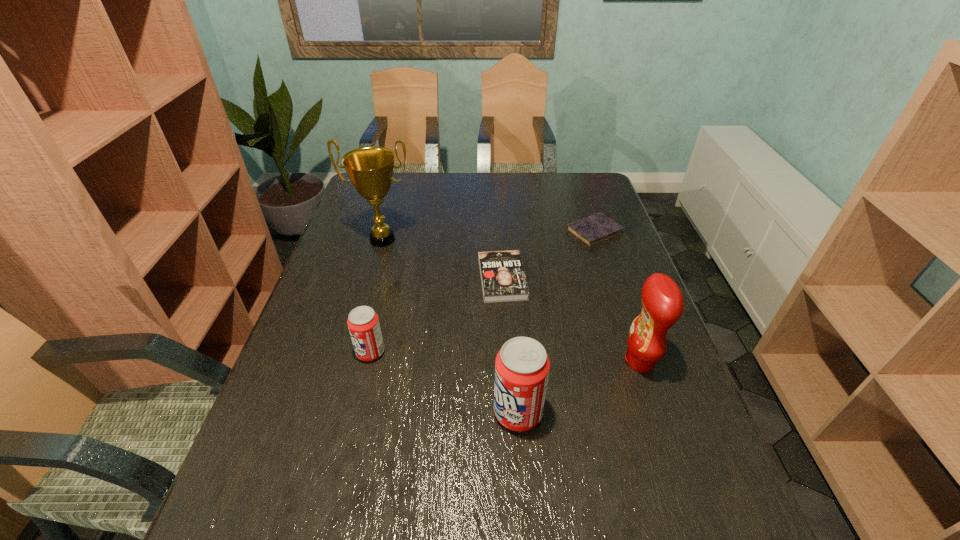
Where is `free spot located 0.140m on the label side of the second tallest object`? free spot located 0.140m on the label side of the second tallest object is located at coordinates (564, 361).

Where is `object positioned at the left edge`? Image resolution: width=960 pixels, height=540 pixels. object positioned at the left edge is located at coordinates (370, 169).

Where is `diary located in the right edge section of the desktop`? The width and height of the screenshot is (960, 540). diary located in the right edge section of the desktop is located at coordinates (592, 230).

This screenshot has height=540, width=960. I want to click on condiment at the right edge, so click(x=662, y=303).

You are a GUI agent. You are given a task and a screenshot of the screen. Output one action in this format:
    pyautogui.click(x=<x>, y=<y>)
    Task: Click on the vacant space at the far edge of the desktop
    This screenshot has width=960, height=540.
    Given the screenshot: What is the action you would take?
    [487, 178]

Locate an element on the screen. This screenshot has height=540, width=960. vacant area at the left edge of the desktop is located at coordinates (339, 261).

Locate an element on the screen. free space at the far left corner is located at coordinates (393, 198).

You are a GUI agent. You are given a task and a screenshot of the screen. Output one action in this format:
    pyautogui.click(x=<x>, y=<y>)
    Task: Click on the vacant space in between the book and the diary
    This screenshot has width=960, height=540.
    Given the screenshot: What is the action you would take?
    pyautogui.click(x=548, y=255)

Identify the location of free spot between the fourth shortest object and the condiment. (579, 387).

You are a GUI agent. You are given a task and a screenshot of the screen. Output one action in this format:
    pyautogui.click(x=<x>, y=<y>)
    Task: Click on the free space between the fourth nearest object and the award
    
    Given the screenshot: What is the action you would take?
    pyautogui.click(x=443, y=259)